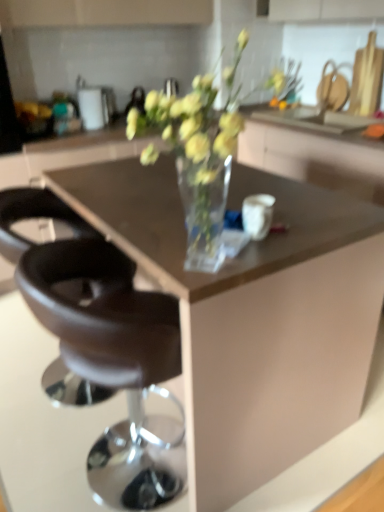
Question: Considering the relative sizes of brown leather stool at center, the first chair positioned from the front, and black leather stool at lower left, which appears as the first chair when viewed from the back, in the image provided, is brown leather stool at center, the first chair positioned from the front, wider than black leather stool at lower left, which appears as the first chair when viewed from the back,?

Choices:
 (A) yes
 (B) no

Answer: (B)

Question: From the image's perspective, is brown leather stool at center, the second chair in the back-to-front sequence, located above black leather stool at lower left, positioned as the second chair in front-to-back order?

Choices:
 (A) yes
 (B) no

Answer: (B)

Question: Is brown leather stool at center, the second chair in the back-to-front sequence, to the left of black leather stool at lower left, which appears as the first chair when viewed from the back, from the viewer's perspective?

Choices:
 (A) yes
 (B) no

Answer: (B)

Question: Would you consider brown leather stool at center, the first chair positioned from the front, to be distant from black leather stool at lower left, positioned as the second chair in front-to-back order?

Choices:
 (A) no
 (B) yes

Answer: (A)

Question: From a real-world perspective, is brown leather stool at center, the second chair in the back-to-front sequence, under black leather stool at lower left, which appears as the first chair when viewed from the back?

Choices:
 (A) no
 (B) yes

Answer: (A)

Question: Is brown leather stool at center, the second chair in the back-to-front sequence, facing towards black leather stool at lower left, which appears as the first chair when viewed from the back?

Choices:
 (A) yes
 (B) no

Answer: (B)

Question: Does transparent glass cabinet at center appear on the left side of brown leather stool at center, the second chair in the back-to-front sequence?

Choices:
 (A) no
 (B) yes

Answer: (A)

Question: Is transparent glass cabinet at center not near brown leather stool at center, the second chair in the back-to-front sequence?

Choices:
 (A) no
 (B) yes

Answer: (B)

Question: Can we say transparent glass cabinet at center lies outside brown leather stool at center, the second chair in the back-to-front sequence?

Choices:
 (A) yes
 (B) no

Answer: (A)

Question: Is transparent glass cabinet at center turned away from brown leather stool at center, the first chair positioned from the front?

Choices:
 (A) no
 (B) yes

Answer: (A)

Question: Is transparent glass cabinet at center closer to the viewer compared to brown leather stool at center, the second chair in the back-to-front sequence?

Choices:
 (A) yes
 (B) no

Answer: (B)

Question: Does transparent glass cabinet at center have a greater width compared to brown leather stool at center, the second chair in the back-to-front sequence?

Choices:
 (A) no
 (B) yes

Answer: (B)

Question: Is brown leather stool at center, the second chair in the back-to-front sequence, at the left side of transparent glass cabinet at center?

Choices:
 (A) yes
 (B) no

Answer: (A)